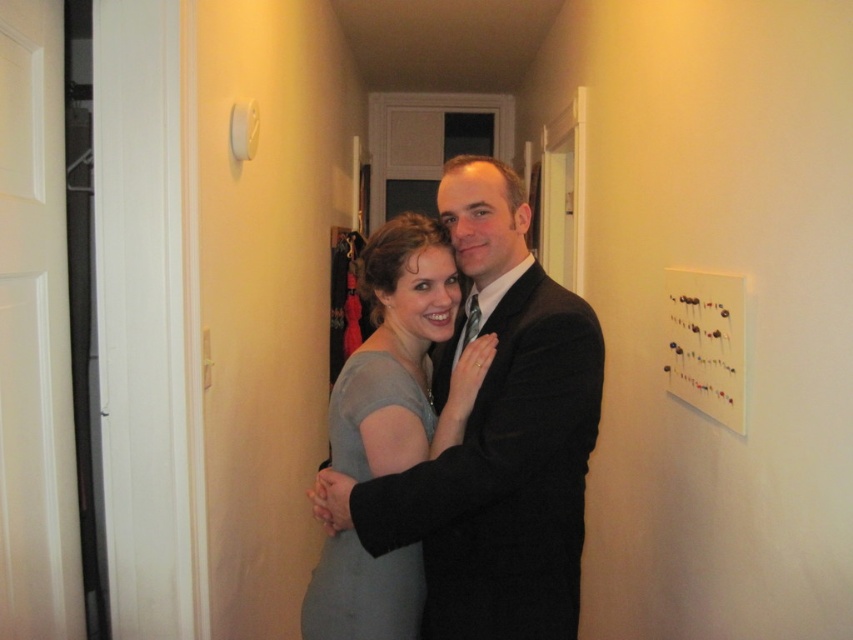
Is point (418, 339) closer to camera compared to point (718, 381)?

Yes, it is.

Can you confirm if matte gray dress at center is shorter than white matte bulletin board at upper right?

No, matte gray dress at center is not shorter than white matte bulletin board at upper right.

Image resolution: width=853 pixels, height=640 pixels. Describe the element at coordinates (403, 356) in the screenshot. I see `matte gray dress at center` at that location.

This screenshot has width=853, height=640. In order to click on matte gray dress at center in this screenshot , I will do `click(403, 356)`.

Is the position of matte gray dress at center more distant than that of gray matte dress at center?

That is False.

Who is more distant from viewer, (404, 451) or (426, 426)?

The point (426, 426) is more distant.

At what (x,y) coordinates should I click in order to perform the action: click on matte gray dress at center. Please return your answer as a coordinate pair (x, y). Image resolution: width=853 pixels, height=640 pixels. Looking at the image, I should click on (403, 356).

Is gray matte dress at center taller than white matte bulletin board at upper right?

Correct, gray matte dress at center is much taller as white matte bulletin board at upper right.

Can you confirm if gray matte dress at center is wider than white matte bulletin board at upper right?

Yes, gray matte dress at center is wider than white matte bulletin board at upper right.

At what (x,y) coordinates should I click in order to perform the action: click on gray matte dress at center. Please return your answer as a coordinate pair (x, y). This screenshot has height=640, width=853. Looking at the image, I should click on (363, 593).

The image size is (853, 640). I want to click on gray matte dress at center, so click(x=363, y=593).